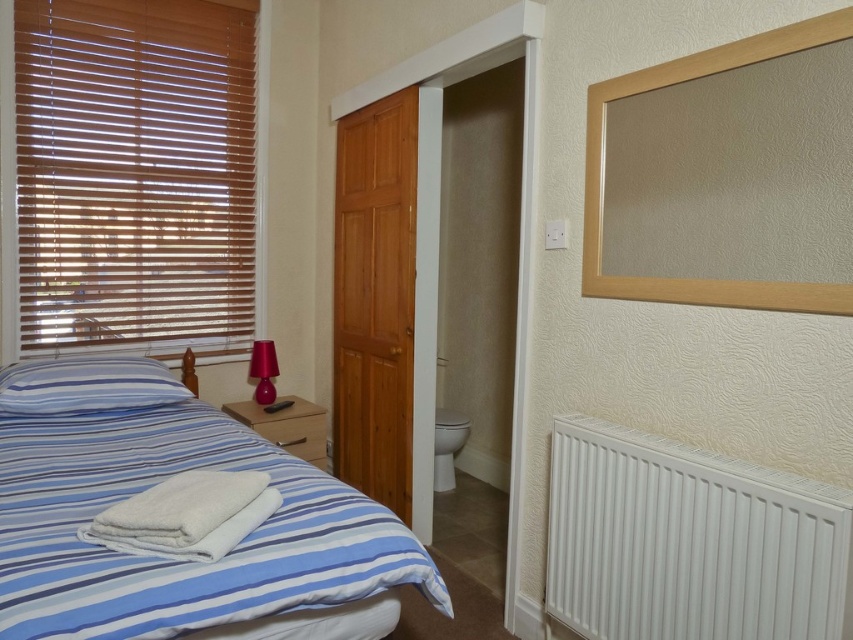
Question: Estimate the real-world distances between objects in this image. Which object is closer to the blue striped pillow at lower left?

Choices:
 (A) blue striped fabric bed at lower left
 (B) white fluffy towel at lower left
 (C) white matte radiator at lower right
 (D) wooden blinds at upper left

Answer: (A)

Question: Can you confirm if wooden blinds at upper left is positioned to the right of white glossy toilet bowl at center?

Choices:
 (A) yes
 (B) no

Answer: (B)

Question: Which point is farther to the camera?

Choices:
 (A) (122, 400)
 (B) (187, 90)
 (C) (440, 417)

Answer: (C)

Question: In this image, where is wooden blinds at upper left located relative to blue striped fabric bed at lower left?

Choices:
 (A) below
 (B) above

Answer: (B)

Question: Is wooden blinds at upper left thinner than white glossy toilet bowl at center?

Choices:
 (A) no
 (B) yes

Answer: (A)

Question: Based on their relative distances, which object is farther from the white matte radiator at lower right?

Choices:
 (A) wooden blinds at upper left
 (B) white fluffy towel at lower left
 (C) blue striped fabric bed at lower left
 (D) white glossy toilet bowl at center

Answer: (A)